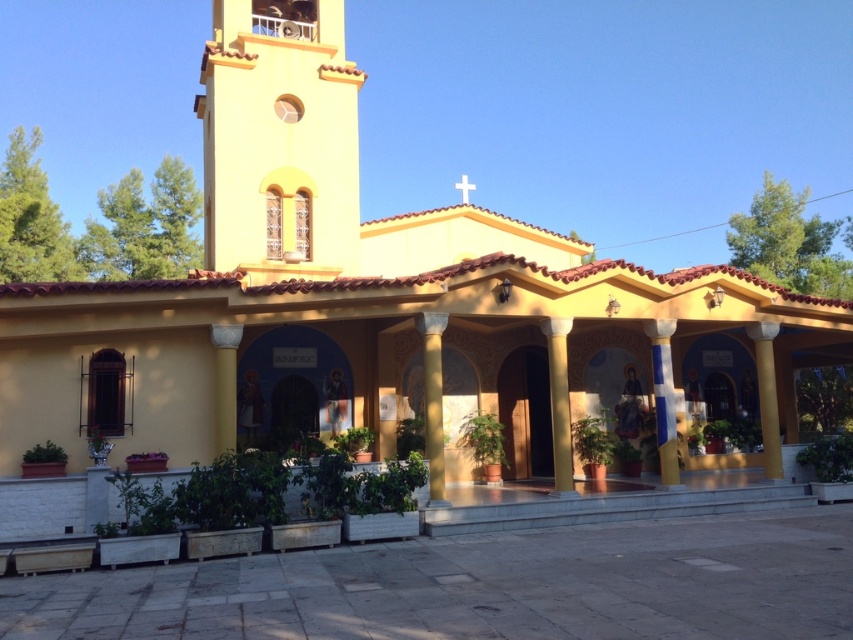
Is point (318, 84) more distant than point (422, 392)?

Yes.

Who is more forward, [315,188] or [428,448]?

Positioned in front is point [428,448].

Locate an element on the screen. yellow stucco bell tower at upper left is located at coordinates (279, 140).